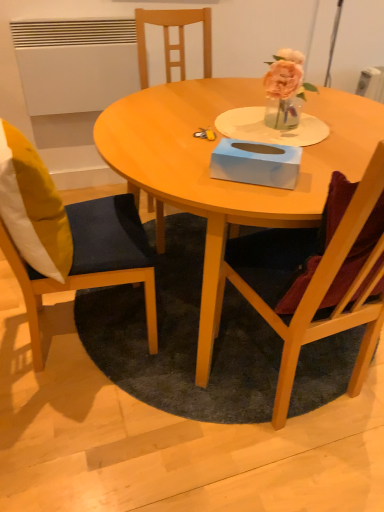
Question: Looking at the image, does wooden chair at left, the first chair in the left-to-right sequence, seem bigger or smaller compared to dark gray carpet at center?

Choices:
 (A) small
 (B) big

Answer: (B)

Question: Considering the positions of point (26, 265) and point (124, 386), is point (26, 265) closer or farther from the camera than point (124, 386)?

Choices:
 (A) closer
 (B) farther

Answer: (A)

Question: Considering the real-world distances, which object is closest to the light blue cardboard tissue box at center?

Choices:
 (A) yellow fabric pillow at left
 (B) wooden chair at left, the first chair in the left-to-right sequence
 (C) wooden chair at right, positioned as the first chair in right-to-left order
 (D) wooden table at center
 (E) dark gray carpet at center

Answer: (D)

Question: Estimate the real-world distances between objects in this image. Which object is closer to the light blue cardboard tissue box at center?

Choices:
 (A) wooden chair at right, positioned as the first chair in right-to-left order
 (B) dark gray carpet at center
 (C) wooden table at center
 (D) wooden chair at left, which is counted as the 2th chair, starting from the right
 (E) yellow fabric pillow at left

Answer: (C)